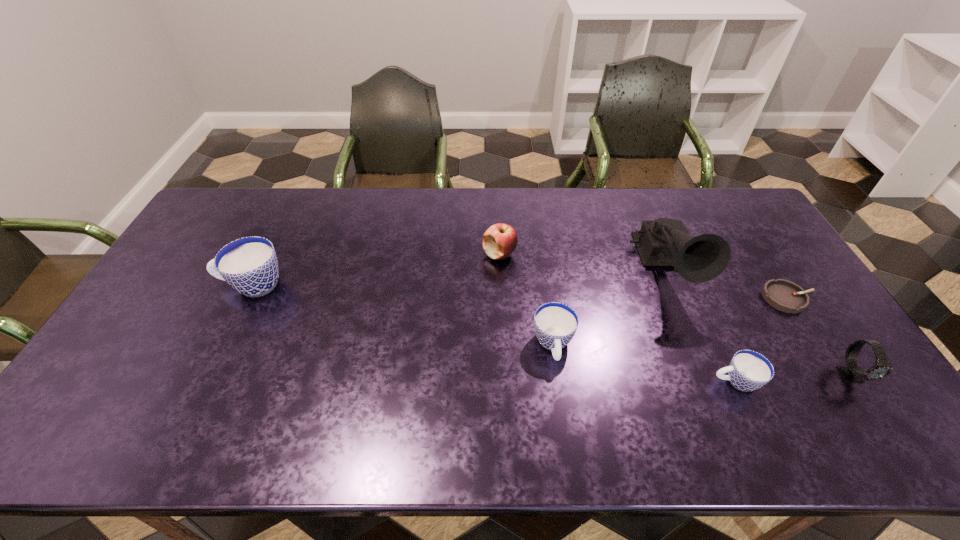
Identify the location of the leftmost cup. (249, 264).

This screenshot has width=960, height=540. Identify the location of the farthest cup. (249, 264).

What are the coordinates of `the third shortest object` in the screenshot? It's located at (555, 323).

You are a GUI agent. You are given a task and a screenshot of the screen. Output one action in this format:
    pyautogui.click(x=<x>, y=<y>)
    Task: Click on the second shortest cup
    The height and width of the screenshot is (540, 960).
    Given the screenshot: What is the action you would take?
    pyautogui.click(x=555, y=323)

Find the location of a particular element. the shortest cup is located at coordinates (748, 370).

Locate an element on the screen. the sixth tallest object is located at coordinates (748, 370).

Image resolution: width=960 pixels, height=540 pixels. Identify the location of the tallest object. (661, 242).

Where is `the shortest object`? This screenshot has height=540, width=960. the shortest object is located at coordinates click(784, 295).

Where is `apple`? The width and height of the screenshot is (960, 540). apple is located at coordinates (500, 240).

The height and width of the screenshot is (540, 960). Find the location of `watch`. watch is located at coordinates (851, 373).